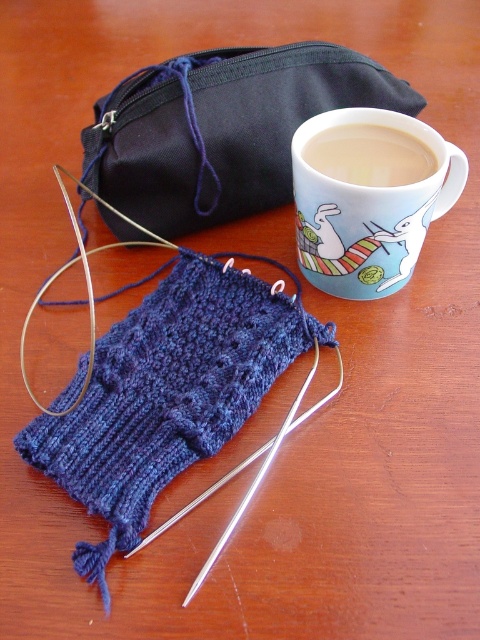
Which of these two, matte ceramic mug at upper right or matte ceramic mug at upper center, stands taller?

With more height is matte ceramic mug at upper right.

This screenshot has width=480, height=640. What do you see at coordinates (369, 196) in the screenshot? I see `matte ceramic mug at upper right` at bounding box center [369, 196].

You are a GUI agent. You are given a task and a screenshot of the screen. Output one action in this format:
    pyautogui.click(x=<x>, y=<y>)
    Task: Click on the matte ceramic mug at upper right
    
    Given the screenshot: What is the action you would take?
    pyautogui.click(x=369, y=196)

Can you confirm if matte black pouch at upper center is positioned to the right of matte ceramic mug at upper right?

In fact, matte black pouch at upper center is to the left of matte ceramic mug at upper right.

Is matte black pouch at upper center below matte ceramic mug at upper right?

Correct, matte black pouch at upper center is located below matte ceramic mug at upper right.

You are a GUI agent. You are given a task and a screenshot of the screen. Output one action in this format:
    pyautogui.click(x=<x>, y=<y>)
    Task: Click on the matte black pouch at upper center
    The width and height of the screenshot is (480, 640).
    Given the screenshot: What is the action you would take?
    point(165,392)

In order to click on matte black pouch at upper center in this screenshot , I will do `click(165, 392)`.

Is black fabric pouch at upper center closer to the viewer compared to matte ceramic mug at upper center?

That is False.

Between black fabric pouch at upper center and matte ceramic mug at upper center, which one is positioned lower?

matte ceramic mug at upper center

Which is in front, point (183, 90) or point (416, 180)?

Point (416, 180) is in front.

Where is `black fabric pouch at upper center`? black fabric pouch at upper center is located at coordinates (222, 129).